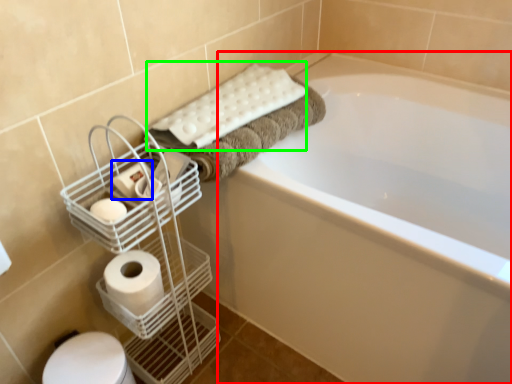
Question: Estimate the real-world distances between objects in this image. Which object is closer to bathtub (highlighted by a red box), toilet paper (highlighted by a blue box) or bath towel (highlighted by a green box)?

Choices:
 (A) toilet paper
 (B) bath towel

Answer: (B)